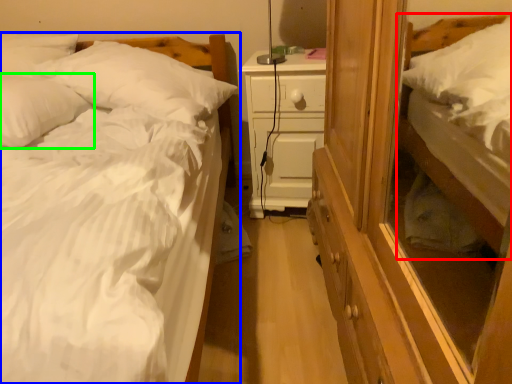
Question: Considering the real-world distances, which object is farthest from bed (highlighted by a red box)? bed (highlighted by a blue box) or pillow (highlighted by a green box)?

Choices:
 (A) bed
 (B) pillow

Answer: (B)